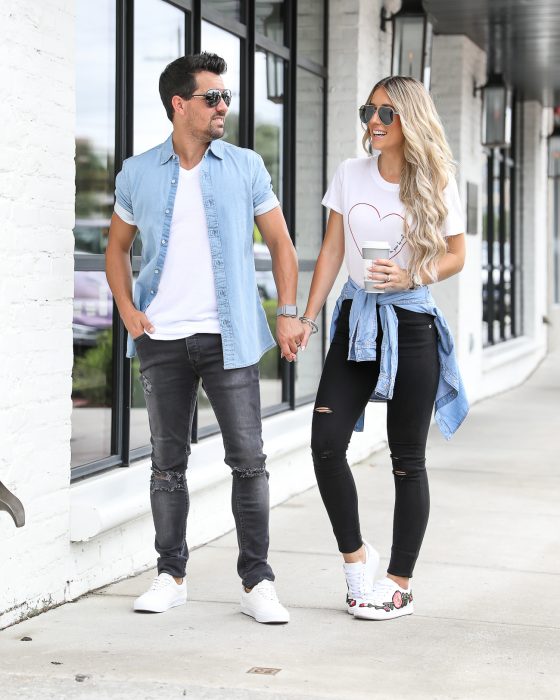
Where is `light`? This screenshot has height=700, width=560. light is located at coordinates (419, 50), (499, 122), (558, 150).